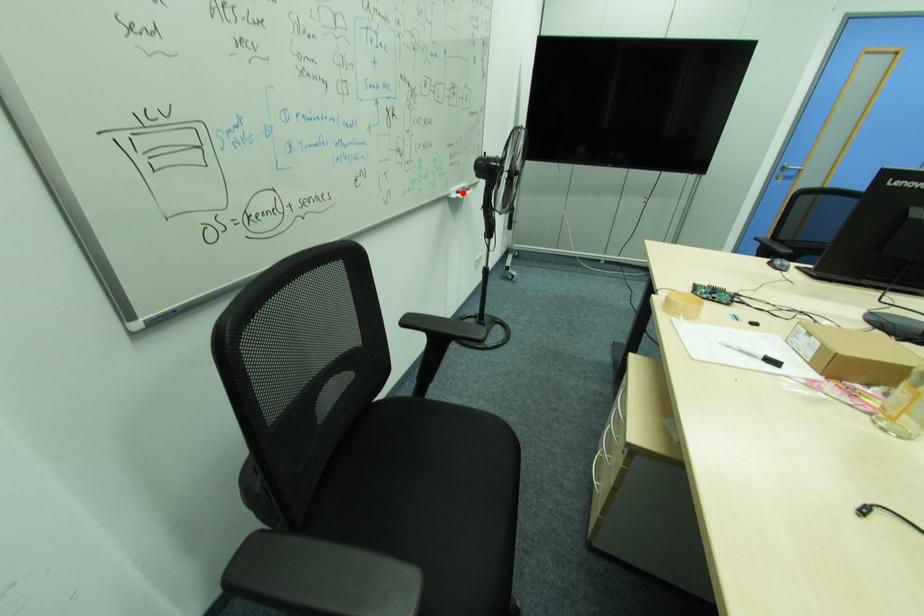
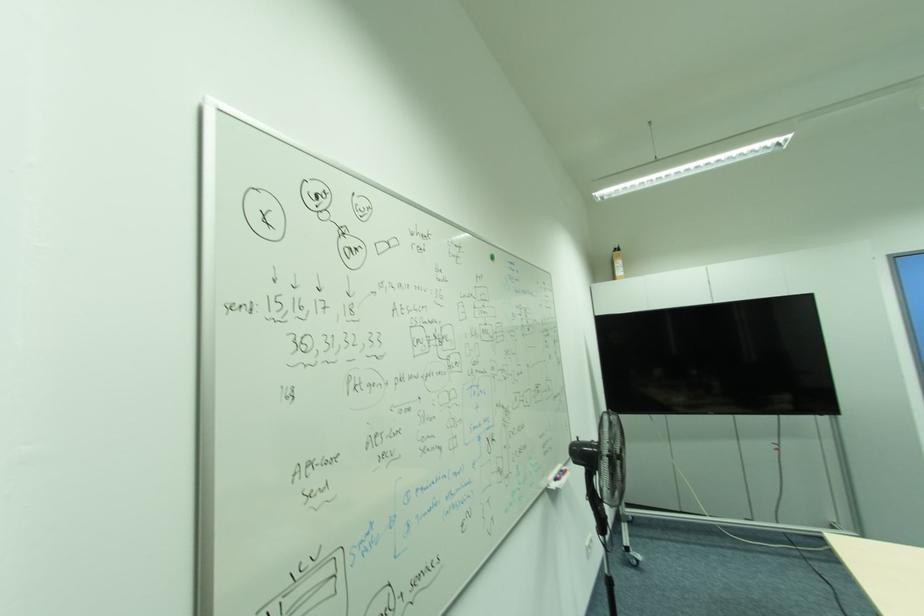
Question: I am providing you with two images of the same scene from different viewpoints. Image1 has a red point marked. In image2, the corresponding 3D location appears at what relative position? Reply with the corresponding letter.

Choices:
 (A) Closer
 (B) Farther

Answer: (B)